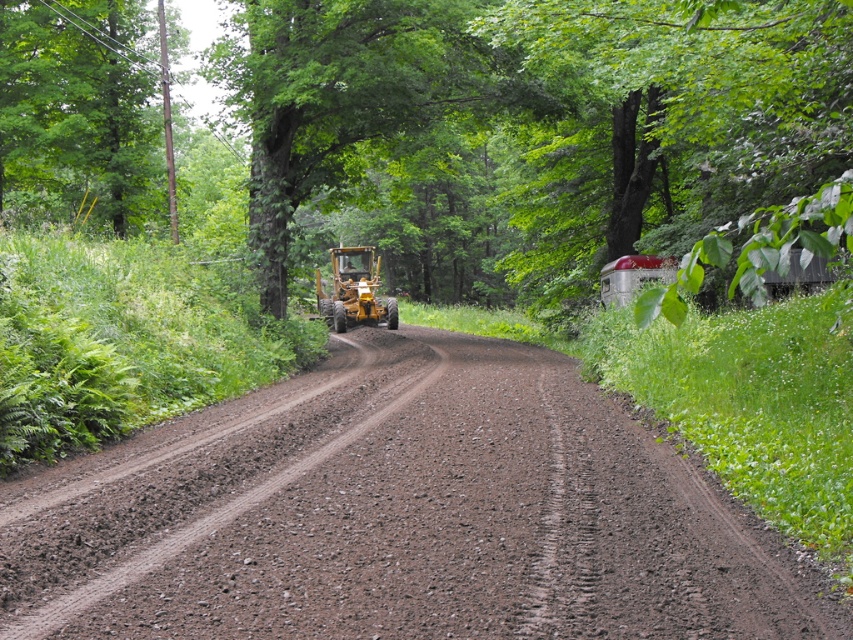
You are a hiker who wants to follow the dirt road through the forest. You see a point marked at coordinates (x=399, y=515) which is part of the brown gravel dirt track at center. Is this point located on the dirt road?

Yes, the point marked at coordinates (x=399, y=515) is part of the brown gravel dirt track at center, so it is located on the dirt road.

You are a surveyor who needs to mark the largest object in the scene for a construction plan. Which object should you choose between the green leafy tree at upper right and the yellow rubber tractor at center?

The green leafy tree at upper right is larger in size than the yellow rubber tractor at center, so you should choose the green leafy tree at upper right for marking in the construction plan.